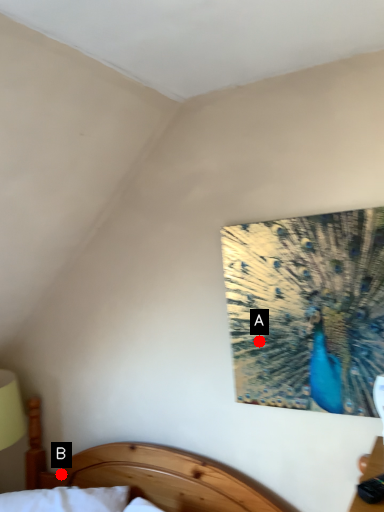
Question: Two points are circled on the image, labeled by A and B beside each circle. Which point is closer to the camera taking this photo?

Choices:
 (A) A is closer
 (B) B is closer

Answer: (A)